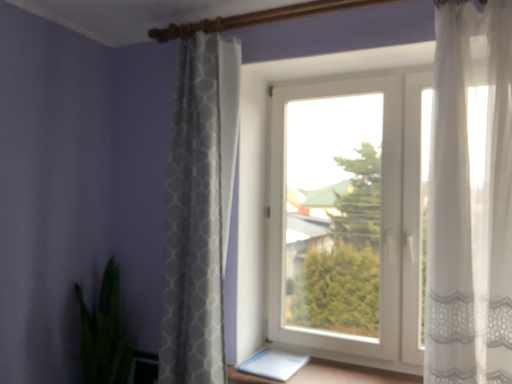
Question: Is green leafy plant at lower left wider than sheer white curtain at right, placed as the second curtain when sorted from back to front?

Choices:
 (A) yes
 (B) no

Answer: (A)

Question: Can you confirm if green leafy plant at lower left is bigger than sheer white curtain at right, which ranks as the 2th curtain in left-to-right order?

Choices:
 (A) no
 (B) yes

Answer: (B)

Question: Does green leafy plant at lower left have a smaller size compared to sheer white curtain at right, which ranks as the 2th curtain in left-to-right order?

Choices:
 (A) yes
 (B) no

Answer: (B)

Question: From a real-world perspective, is green leafy plant at lower left located beneath sheer white curtain at right, placed as the second curtain when sorted from back to front?

Choices:
 (A) yes
 (B) no

Answer: (A)

Question: Is green leafy plant at lower left placed right next to sheer white curtain at right, acting as the 1th curtain starting from the right?

Choices:
 (A) yes
 (B) no

Answer: (B)

Question: From a real-world perspective, does green leafy plant at lower left stand above sheer white curtain at right, acting as the 1th curtain starting from the right?

Choices:
 (A) no
 (B) yes

Answer: (A)

Question: Is the position of white textured curtain at center, which is the second curtain in right-to-left order, more distant than that of sheer white curtain at right, which ranks as the 2th curtain in left-to-right order?

Choices:
 (A) yes
 (B) no

Answer: (A)

Question: Could you tell me if white textured curtain at center, which is the second curtain in right-to-left order, is turned towards sheer white curtain at right, which is the first curtain in front-to-back order?

Choices:
 (A) no
 (B) yes

Answer: (A)

Question: From a real-world perspective, does white textured curtain at center, which is the second curtain in right-to-left order, sit lower than sheer white curtain at right, acting as the 1th curtain starting from the right?

Choices:
 (A) yes
 (B) no

Answer: (A)

Question: Can you confirm if white textured curtain at center, placed as the 2th curtain when sorted from front to back, is taller than sheer white curtain at right, which is the first curtain in front-to-back order?

Choices:
 (A) yes
 (B) no

Answer: (A)

Question: From a real-world perspective, is white textured curtain at center, placed as the 2th curtain when sorted from front to back, physically above sheer white curtain at right, which ranks as the 2th curtain in left-to-right order?

Choices:
 (A) no
 (B) yes

Answer: (A)

Question: From the image's perspective, is white textured curtain at center, placed as the 2th curtain when sorted from front to back, under sheer white curtain at right, which ranks as the 2th curtain in left-to-right order?

Choices:
 (A) yes
 (B) no

Answer: (A)

Question: Is white textured curtain at center, placed as the 2th curtain when sorted from front to back, further to camera compared to white plastic window at center?

Choices:
 (A) no
 (B) yes

Answer: (A)